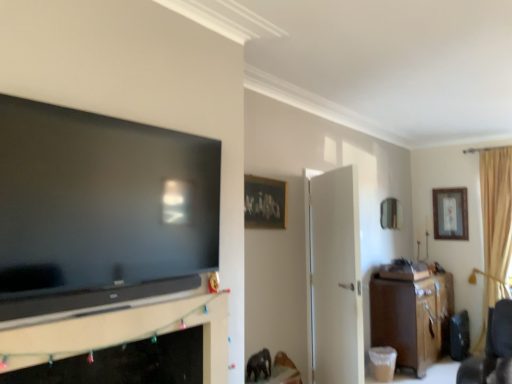
Question: Can you confirm if brown wood cabinet at right is taller than wooden framed artwork at upper center, the third picture frame viewed from the right?

Choices:
 (A) yes
 (B) no

Answer: (A)

Question: From a real-world perspective, is brown wood cabinet at right over wooden framed artwork at upper center, the third picture frame viewed from the right?

Choices:
 (A) no
 (B) yes

Answer: (A)

Question: Is brown wood cabinet at right positioned behind wooden framed artwork at upper center, marked as the first picture frame in a front-to-back arrangement?

Choices:
 (A) no
 (B) yes

Answer: (B)

Question: Is brown wood cabinet at right far from wooden framed artwork at upper center, marked as the first picture frame in a front-to-back arrangement?

Choices:
 (A) yes
 (B) no

Answer: (A)

Question: Does brown wood cabinet at right turn towards wooden framed artwork at upper center, placed as the first picture frame when sorted from left to right?

Choices:
 (A) no
 (B) yes

Answer: (A)

Question: Is wooden framed artwork at upper center, which appears as the 3th picture frame when viewed from the back, surrounded by brown wood cabinet at right?

Choices:
 (A) yes
 (B) no

Answer: (B)

Question: Are metallic mirror at upper right, which is the 2th picture frame from back to front, and beige fabric curtain at right far apart?

Choices:
 (A) yes
 (B) no

Answer: (A)

Question: Is metallic mirror at upper right, which is the second picture frame in left-to-right order, shorter than beige fabric curtain at right?

Choices:
 (A) yes
 (B) no

Answer: (A)

Question: Is metallic mirror at upper right, which is the 2th picture frame from back to front, outside beige fabric curtain at right?

Choices:
 (A) yes
 (B) no

Answer: (A)

Question: Is metallic mirror at upper right, which is the 2th picture frame from back to front, at the right side of beige fabric curtain at right?

Choices:
 (A) yes
 (B) no

Answer: (B)

Question: Does metallic mirror at upper right, the 2th picture frame in the right-to-left sequence, turn towards beige fabric curtain at right?

Choices:
 (A) yes
 (B) no

Answer: (A)

Question: Is metallic mirror at upper right, the second picture frame when ordered from front to back, positioned behind beige fabric curtain at right?

Choices:
 (A) no
 (B) yes

Answer: (B)

Question: From a real-world perspective, is beige fabric curtain at right located higher than wooden framed picture at upper right, acting as the 1th picture frame starting from the back?

Choices:
 (A) no
 (B) yes

Answer: (A)